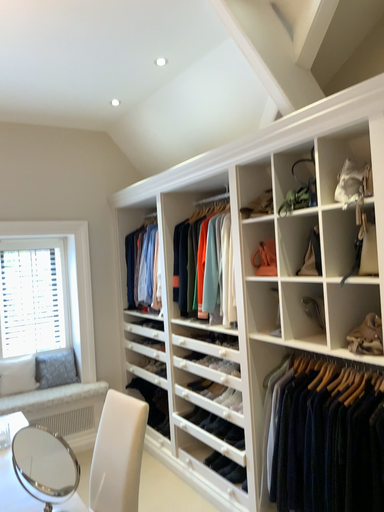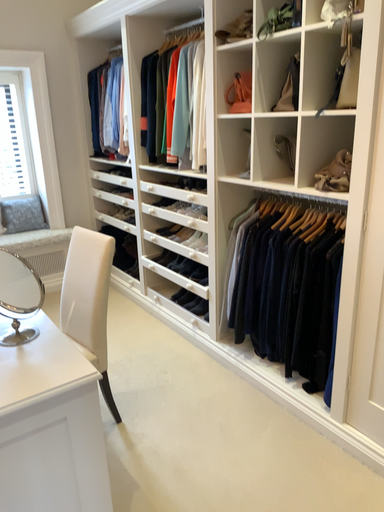
Question: Which way did the camera rotate in the video?

Choices:
 (A) rotated upward
 (B) rotated downward

Answer: (B)